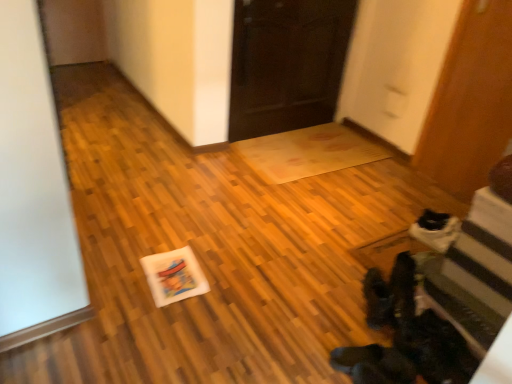
Question: Considering the relative positions of dark wood door at center, which appears as the 1th door when viewed from the left, and wooden door at right, which appears as the 1th door when viewed from the right, in the image provided, is dark wood door at center, which appears as the 1th door when viewed from the left, to the right of wooden door at right, which appears as the 1th door when viewed from the right, from the viewer's perspective?

Choices:
 (A) no
 (B) yes

Answer: (A)

Question: From a real-world perspective, is dark wood door at center, placed as the 2th door when sorted from right to left, positioned under wooden door at right, which appears as the 1th door when viewed from the right, based on gravity?

Choices:
 (A) no
 (B) yes

Answer: (B)

Question: From a real-world perspective, does dark wood door at center, placed as the 2th door when sorted from right to left, stand above wooden door at right, which ranks as the second door in left-to-right order?

Choices:
 (A) yes
 (B) no

Answer: (B)

Question: Is dark wood door at center, which appears as the 1th door when viewed from the left, bigger than wooden door at right, which ranks as the second door in left-to-right order?

Choices:
 (A) no
 (B) yes

Answer: (B)

Question: Does dark wood door at center, which appears as the 1th door when viewed from the left, lie in front of wooden door at right, which ranks as the second door in left-to-right order?

Choices:
 (A) no
 (B) yes

Answer: (A)

Question: In the image, is wooden door at right, which appears as the 1th door when viewed from the right, positioned in front of or behind black suede boots at lower right?

Choices:
 (A) behind
 (B) front

Answer: (A)

Question: Considering the positions of wooden door at right, which appears as the 1th door when viewed from the right, and black suede boots at lower right in the image, is wooden door at right, which appears as the 1th door when viewed from the right, bigger or smaller than black suede boots at lower right?

Choices:
 (A) big
 (B) small

Answer: (A)

Question: In terms of height, does wooden door at right, which appears as the 1th door when viewed from the right, look taller or shorter compared to black suede boots at lower right?

Choices:
 (A) short
 (B) tall

Answer: (B)

Question: Is wooden door at right, which appears as the 1th door when viewed from the right, inside or outside of black suede boots at lower right?

Choices:
 (A) outside
 (B) inside

Answer: (A)

Question: Is white matte postcard at center taller or shorter than black suede boots at lower right?

Choices:
 (A) short
 (B) tall

Answer: (A)

Question: From the image's perspective, is white matte postcard at center located above or below black suede boots at lower right?

Choices:
 (A) above
 (B) below

Answer: (A)

Question: From a real-world perspective, is white matte postcard at center positioned above or below black suede boots at lower right?

Choices:
 (A) above
 (B) below

Answer: (B)

Question: Does point (174, 294) appear closer or farther from the camera than point (374, 309)?

Choices:
 (A) closer
 (B) farther

Answer: (B)

Question: From the image's perspective, is white matte postcard at center located above or below wooden door at right, which appears as the 1th door when viewed from the right?

Choices:
 (A) below
 (B) above

Answer: (A)

Question: Which is correct: white matte postcard at center is inside wooden door at right, which ranks as the second door in left-to-right order, or outside of it?

Choices:
 (A) outside
 (B) inside

Answer: (A)